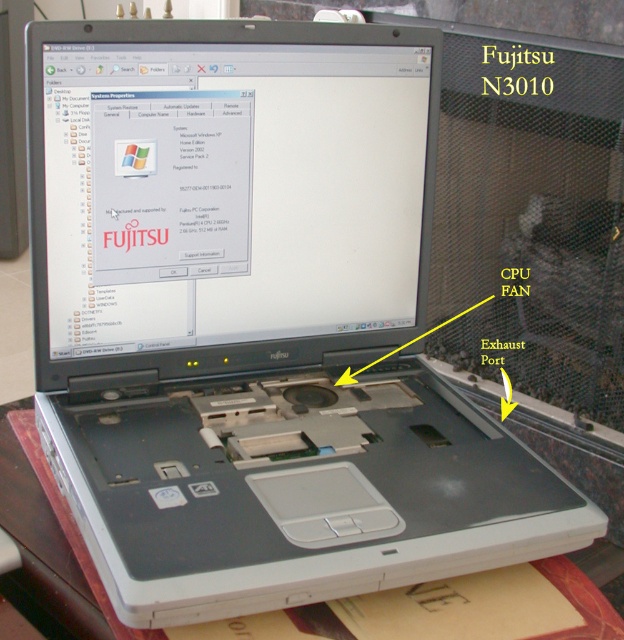
You are setting up a desk and need to place both the matte black screen at center and the white plastic table at lower center. Based on their thickness, which object should be placed first to ensure stability?

The matte black screen at center is thinner than the white plastic table at lower center. To ensure stability, the thicker white plastic table at lower center should be placed first as a base, then the thinner matte black screen at center on top.

You are holding a 20 inch ruler and want to measure the distance from the camera to the point at coordinates point (105, 248). Can you determine if the ruler is long enough to reach that distance?

The distance between the camera and point (105, 248) is 30.98 inches, which is longer than the 20 inch ruler. Therefore, the ruler is not long enough to measure the distance.

You are trying to locate the matte black screen at center in the image. According to the coordinates provided, where exactly is it positioned?

The matte black screen at center is located at point coordinates (230, 189).